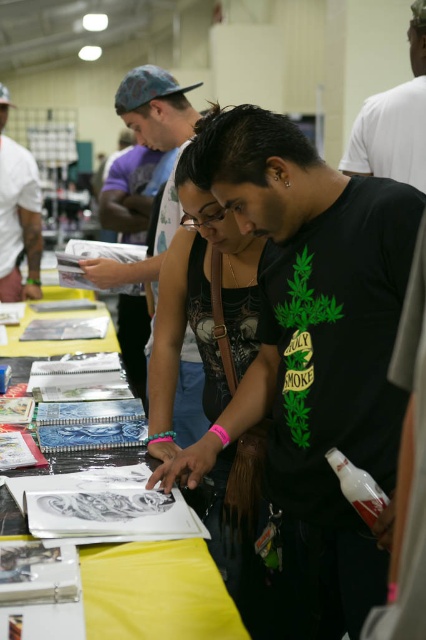
Question: Does matte black tank top at center have a larger size compared to black matte t-shirt at center?

Choices:
 (A) yes
 (B) no

Answer: (A)

Question: Which object is farther from the camera taking this photo?

Choices:
 (A) dark skin tattoo at upper left
 (B) matte black tank top at center
 (C) matte black t-shirt at center
 (D) black matte t-shirt at center

Answer: (A)

Question: Among these objects, which one is nearest to the camera?

Choices:
 (A) yellow paper at center
 (B) dark skin tattoo at upper left
 (C) matte black t-shirt at center

Answer: (A)

Question: Is black matte t-shirt at center further to camera compared to dark skin tattoo at upper left?

Choices:
 (A) yes
 (B) no

Answer: (B)

Question: Is black matte t-shirt at center above dark skin tattoo at upper left?

Choices:
 (A) no
 (B) yes

Answer: (B)

Question: Which of the following is the farthest from the observer?

Choices:
 (A) (176, 99)
 (B) (409, 58)
 (C) (137, 570)

Answer: (B)